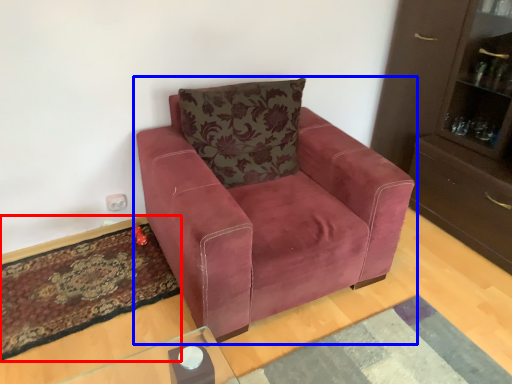
Question: Among these objects, which one is nearest to the camera, mat (highlighted by a red box) or chair (highlighted by a blue box)?

Choices:
 (A) mat
 (B) chair

Answer: (B)